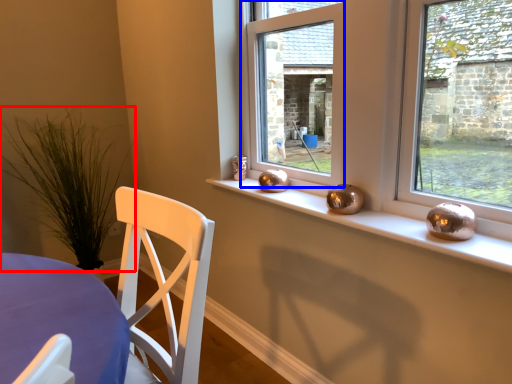
Question: Which of the following is the farthest to the observer, plant (highlighted by a red box) or window (highlighted by a blue box)?

Choices:
 (A) plant
 (B) window

Answer: (A)